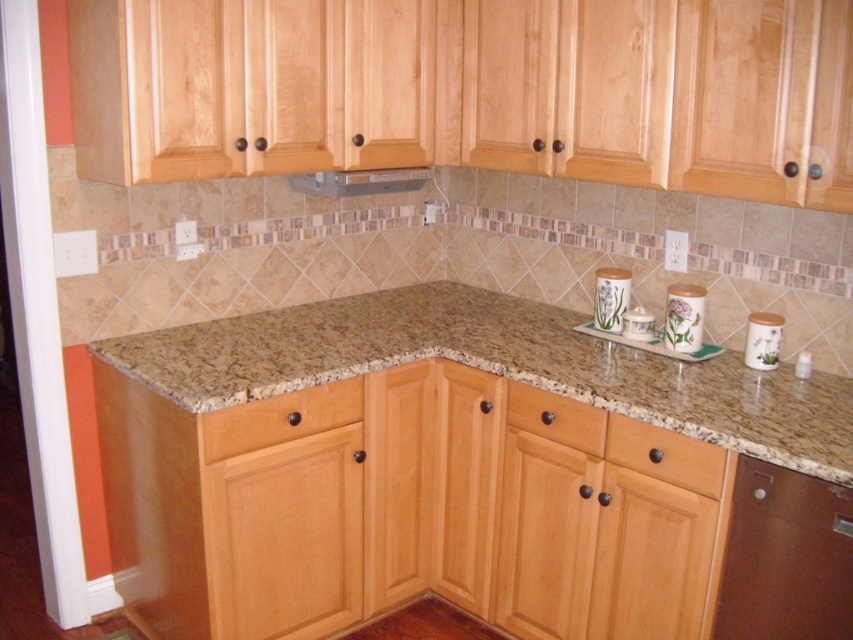
Is matte wood drawer at center positioned in front of white ceramic canister at right?

Yes, it is in front of white ceramic canister at right.

Is matte wood drawer at center to the left of white ceramic canister at right from the viewer's perspective?

Correct, you'll find matte wood drawer at center to the left of white ceramic canister at right.

Image resolution: width=853 pixels, height=640 pixels. Identify the location of matte wood drawer at center. (556, 417).

Based on the photo, does matte wood drawer at center have a lesser width compared to porcelain floral-patterned canister at right?

In fact, matte wood drawer at center might be wider than porcelain floral-patterned canister at right.

Between point (561, 428) and point (746, 333), which one is positioned behind?

Point (746, 333)

Which is behind, point (509, 388) or point (776, 356)?

The point (509, 388) is behind.

At what (x,y) coordinates should I click in order to perform the action: click on matte wood drawer at center. Please return your answer as a coordinate pair (x, y). The width and height of the screenshot is (853, 640). Looking at the image, I should click on [556, 417].

Can you confirm if matte wood drawer at center is shorter than metallic stainless steel exhaust hood at upper center?

Incorrect, matte wood drawer at center's height does not fall short of metallic stainless steel exhaust hood at upper center's.

Is point (514, 412) positioned before point (316, 186)?

That is True.

The image size is (853, 640). I want to click on matte wood drawer at center, so click(556, 417).